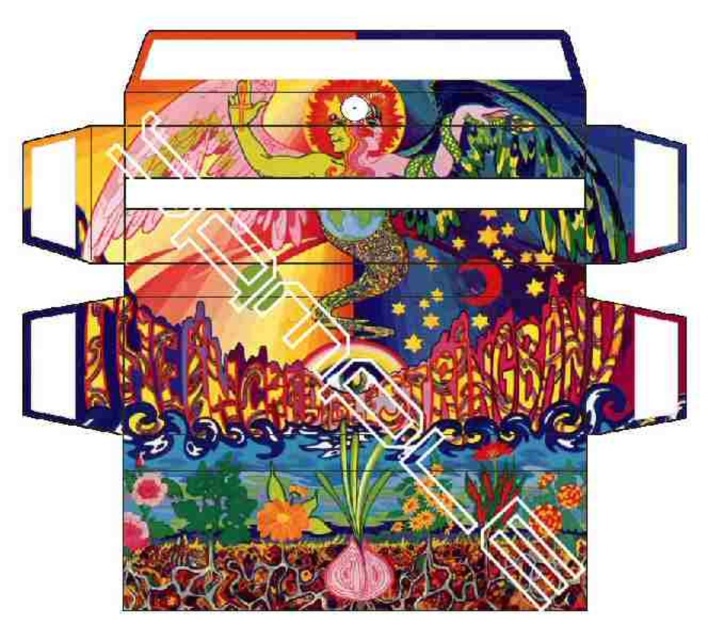
Can you confirm if matte pink flower at lower center is smaller than matte pink flower at lower left?

Indeed, matte pink flower at lower center has a smaller size compared to matte pink flower at lower left.

Does matte pink flower at lower center appear under matte pink flower at lower left?

Actually, matte pink flower at lower center is above matte pink flower at lower left.

Is point (154, 502) in front of point (135, 525)?

That is False.

I want to click on matte pink flower at lower center, so click(148, 490).

Is matte orange flower at lower center smaller than matte pink flower at lower left?

Incorrect, matte orange flower at lower center is not smaller in size than matte pink flower at lower left.

Who is more distant from viewer, [278,516] or [147,532]?

Positioned behind is point [278,516].

The height and width of the screenshot is (640, 708). I want to click on matte orange flower at lower center, so click(282, 518).

Does matte pink flower at lower center have a greater height compared to orange matte flower at center?

Correct, matte pink flower at lower center is much taller as orange matte flower at center.

Is matte pink flower at lower center in front of orange matte flower at center?

That is True.

Identify the location of matte pink flower at lower center. The height and width of the screenshot is (640, 708). (148, 490).

Where is `matte pink flower at lower center`? matte pink flower at lower center is located at coordinates (148, 490).